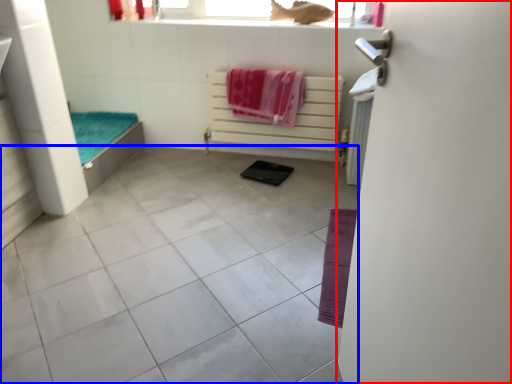
Question: Which object appears closest to the camera in this image, screen door (highlighted by a red box) or ceramic tile (highlighted by a blue box)?

Choices:
 (A) screen door
 (B) ceramic tile

Answer: (A)